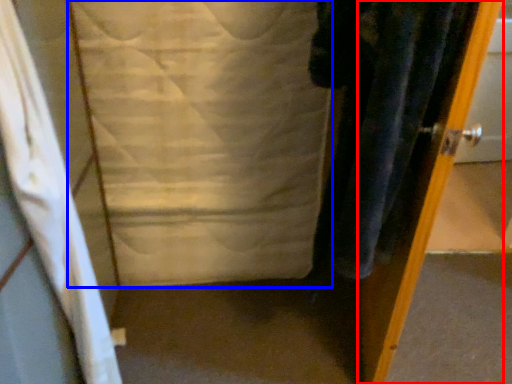
Question: Which object appears closest to the camera in this image, door (highlighted by a red box) or sheet (highlighted by a blue box)?

Choices:
 (A) door
 (B) sheet

Answer: (A)